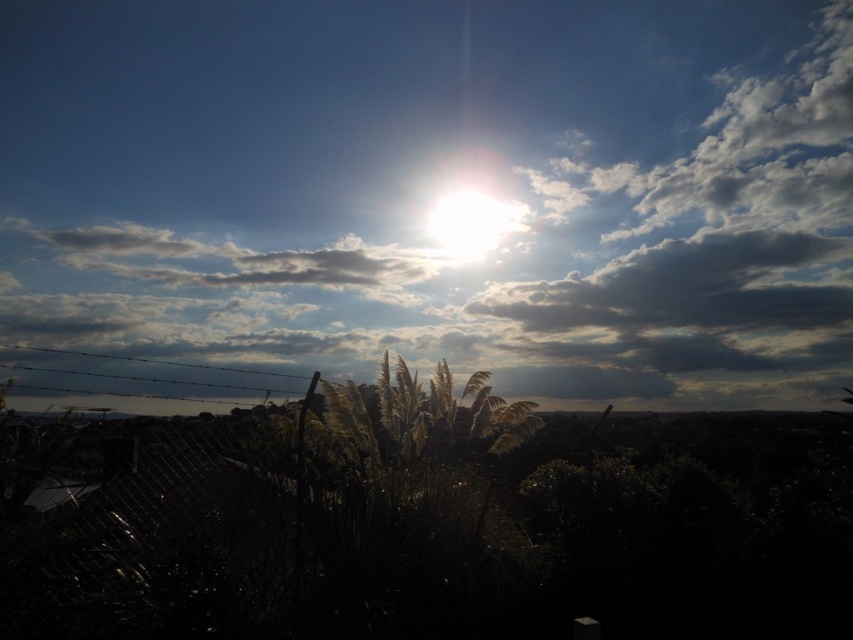
You are an astronomer observing the sky and the landscape. You notice the white fluffy cloud at upper center and the silvery grass at center. Which object is higher in the sky?

The white fluffy cloud at upper center is higher in the sky than the silvery grass at center because it is positioned above it.

From the picture: You are an astronomer observing the sky and notice the white fluffy cloud at upper center and the bright white sun at upper center. Which object is blocking the sunlight in this scene?

The white fluffy cloud at upper center is positioned over the bright white sun at upper center, so it is blocking the sunlight in this scene.